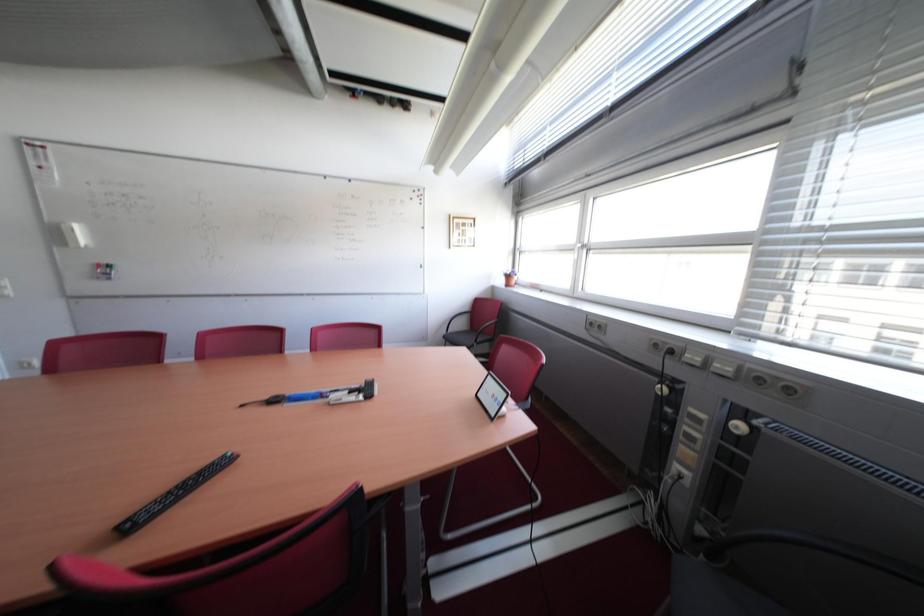
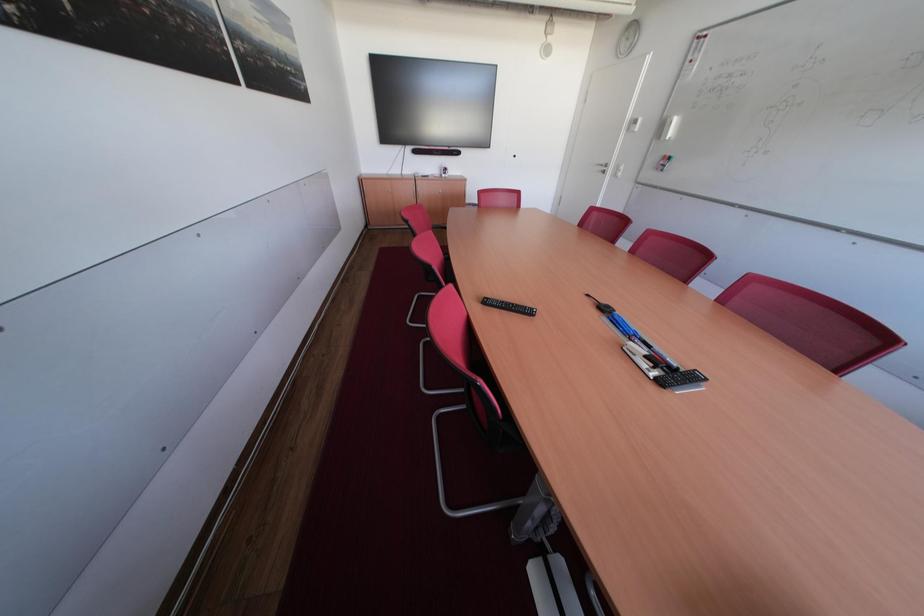
In the scene shown: The first image is from the beginning of the video and the second image is from the end. How did the camera likely rotate when shooting the video?

The camera's rotation is toward left-down.